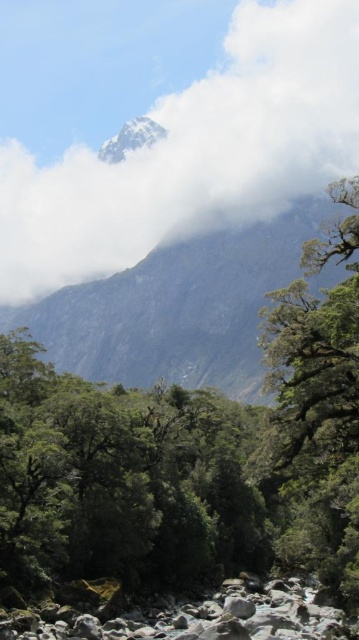
You are an airplane passenger looking out the window and see the white fluffy cloud at upper center and the rocky gray mountain at upper center. Which object is closer to you?

The white fluffy cloud at upper center is closer to you because it is further to the viewer than the rocky gray mountain at upper center.

You are an airplane pilot flying over the mountain. You notice the white fluffy cloud at upper center and the rocky gray mountain at upper center. Which one has a larger width?

The white fluffy cloud at upper center has a larger width than the rocky gray mountain at upper center according to the description.